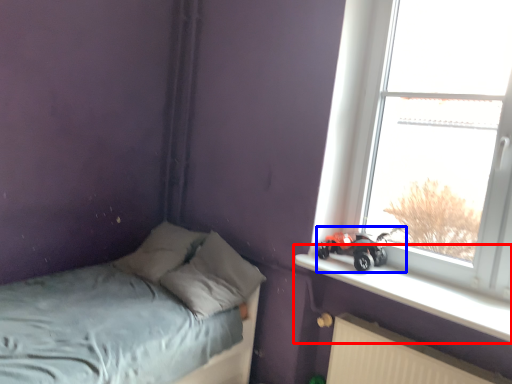
Question: Which of the following is the farthest to the observer, window sill (highlighted by a red box) or land vehicle (highlighted by a blue box)?

Choices:
 (A) window sill
 (B) land vehicle

Answer: (B)